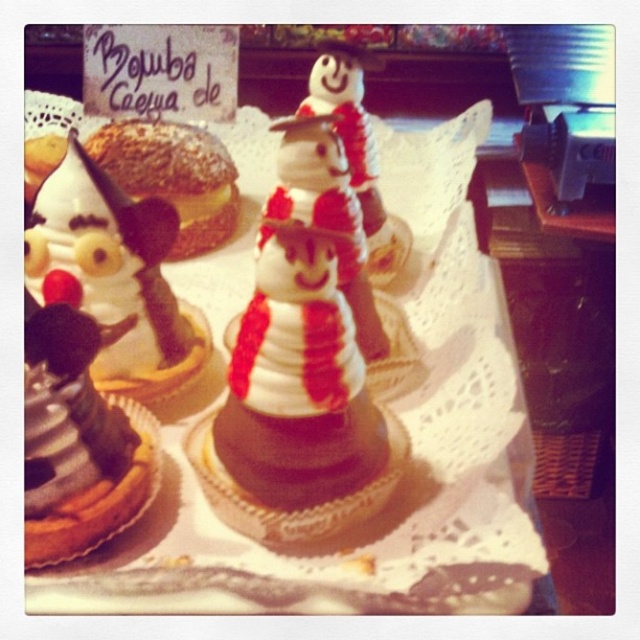
You are a customer at the bakery and want to choose the wider dessert between the white chocolate snowman at center and the white chocolate ice cream at left. Which one should you choose?

The white chocolate snowman at center is wider than the white chocolate ice cream at left, so you should choose the white chocolate snowman at center.

In the scene shown: You are a customer at the bakery and want to choose between the white chocolate ice cream at left and the white frosting snowman at center. Which one has a larger width?

The white chocolate ice cream at left might be wider than white frosting snowman at center according to the description.